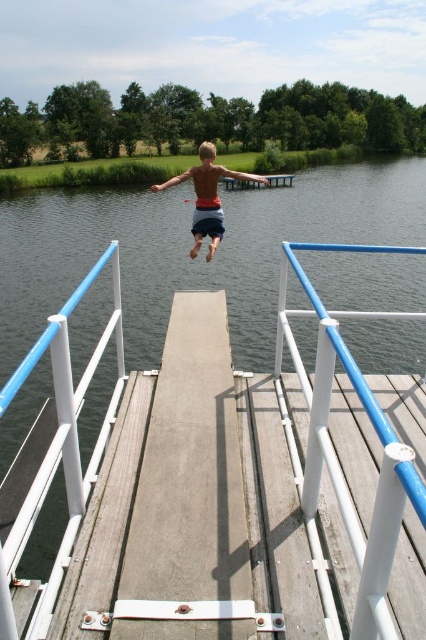
You are a drone operator trying to capture the perfect shot of the diving boy. You need to position your drone to avoid the white plastic rail at center. What coordinates should you avoid to keep the rail out of the shot?

You should avoid the coordinates point (337, 454) to keep the white plastic rail at center out of the shot.